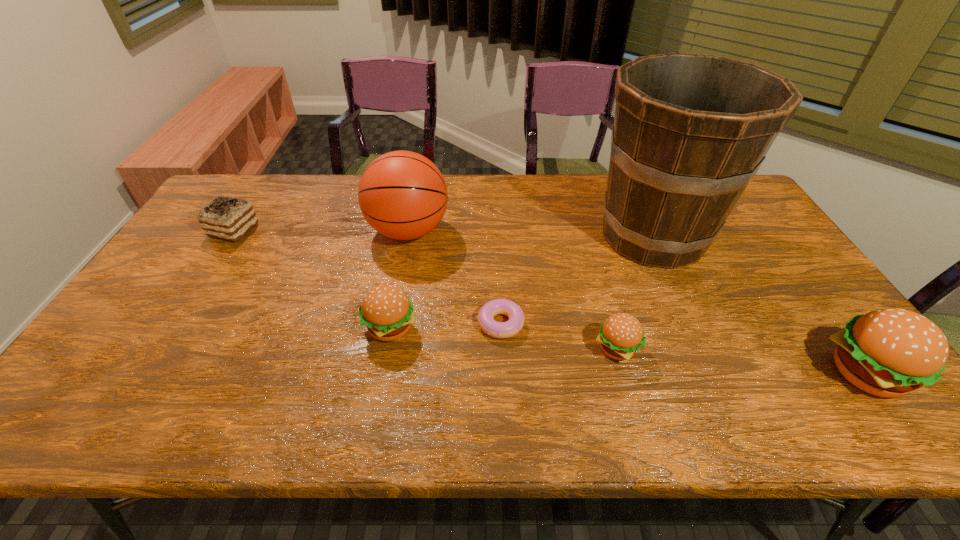
Locate an element on the screen. The image size is (960, 540). object positioned at the right edge is located at coordinates (890, 352).

At what (x,y) coordinates should I click in order to perform the action: click on object situated at the near right corner. Please return your answer as a coordinate pair (x, y). Image resolution: width=960 pixels, height=540 pixels. Looking at the image, I should click on (890, 352).

In the image, there is a desktop. At what (x,y) coordinates should I click in order to perform the action: click on vacant area at the far edge. Please return your answer as a coordinate pair (x, y). Image resolution: width=960 pixels, height=540 pixels. Looking at the image, I should click on (331, 178).

Locate an element on the screen. This screenshot has height=540, width=960. vacant space at the near edge is located at coordinates pos(324,366).

The image size is (960, 540). In order to click on vacant space at the left edge of the desktop in this screenshot , I will do `click(134, 341)`.

At what (x,y) coordinates should I click in order to perform the action: click on vacant space at the right edge of the desktop. Please return your answer as a coordinate pair (x, y). Looking at the image, I should click on 735,236.

Identify the location of vacant point located between the second hamburger from left to right and the basketball. The height and width of the screenshot is (540, 960). (513, 290).

This screenshot has height=540, width=960. Identify the location of vacant area between the shortest hamburger and the rightmost object. (740, 361).

The height and width of the screenshot is (540, 960). I want to click on free spot between the sixth shortest object and the bucket, so click(x=531, y=233).

What are the coordinates of `vacant point located between the shortest object and the second tallest hamburger` in the screenshot? It's located at (445, 325).